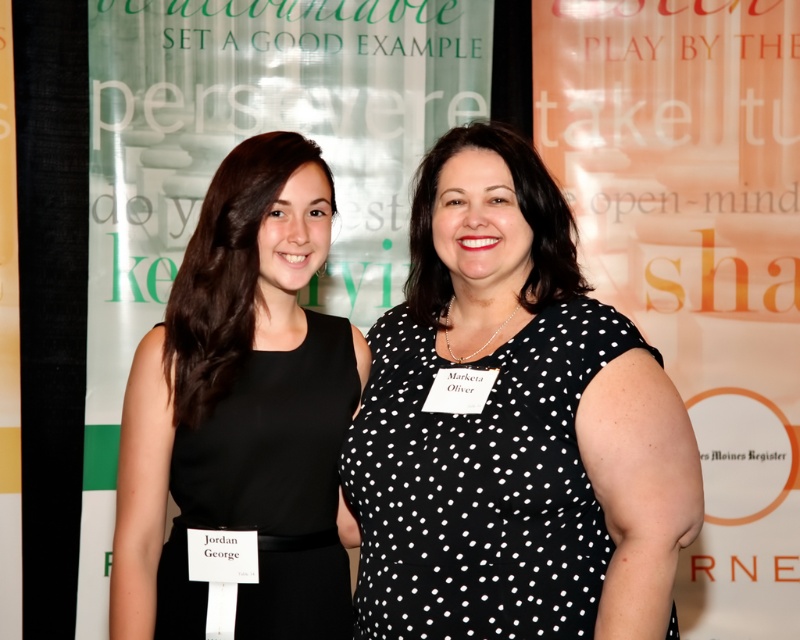
You are at a formal event and want to take a photo with the green fabric banner at upper center in the background. Can you position yourself so that the black dotted dress at center is between you and the banner?

Yes, because the black dotted dress at center is closer to the viewer than the green fabric banner at upper center, positioning yourself behind the dress will place it between you and the banner.

You are a photographer standing 2 meters away from the black matte dress at left. You want to take a photo of the green fabric banner at upper center without moving your position. Is the banner within your camera lens range if your camera can focus up to 3 meters away?

The distance between the green fabric banner at upper center and the black matte dress at left is 1.26 meters. Since you are 2 meters away from the dress, the banner is 2 meters plus 1.26 meters away from you, totaling 3.26 meters. The camera can focus up to 3 meters, so the banner is slightly out of focus range.

You are a photographer who needs to adjust your camera focus to the black dotted dress at center. Given that the camera screen coordinates are mapped from 0 to 1 in both X and Y axes, where the top left corner is coordinate origin, can you confirm the exact coordinates to focus on?

The exact coordinates to focus on the black dotted dress at center are at point (x=512, y=426).